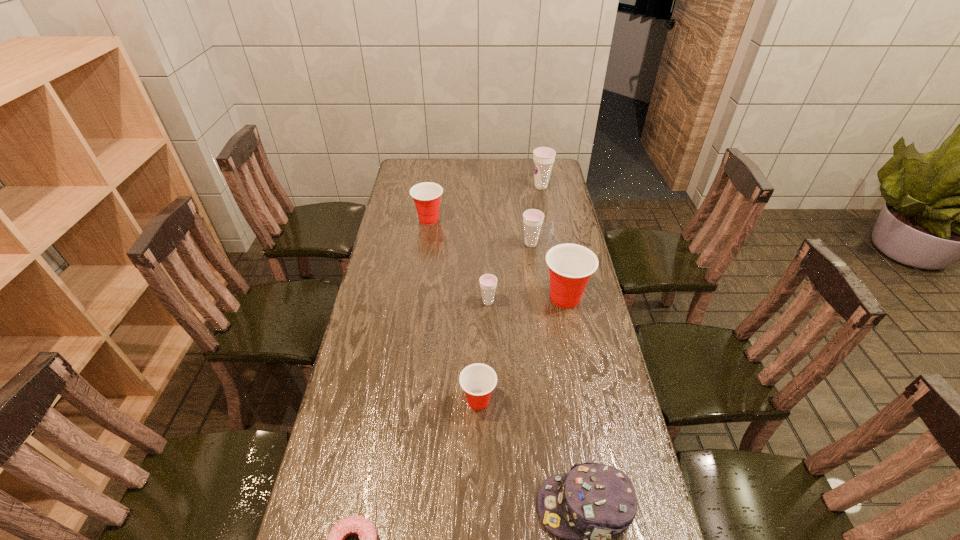
At what (x,y) coordinates should I click in order to perform the action: click on the nearest red cup. Please return your answer as a coordinate pair (x, y). Image resolution: width=960 pixels, height=540 pixels. Looking at the image, I should click on (478, 380).

Identify the location of the nearest cup. Image resolution: width=960 pixels, height=540 pixels. (478, 380).

Locate an element on the screen. vacant area located on the front of the biggest purple cup is located at coordinates (543, 199).

The image size is (960, 540). Identify the location of vacant space situated on the left of the biggest red cup. (482, 298).

The width and height of the screenshot is (960, 540). Find the location of `vacant space situated on the front of the second smallest red cup`. vacant space situated on the front of the second smallest red cup is located at coordinates click(421, 273).

Identify the location of vacant space located on the front of the third farthest object. (535, 272).

The width and height of the screenshot is (960, 540). In order to click on free space located on the left of the leftmost purple cup in this screenshot , I will do `click(420, 302)`.

Where is `free spot located 0.100m on the left of the nearest cup`? The height and width of the screenshot is (540, 960). free spot located 0.100m on the left of the nearest cup is located at coordinates (425, 401).

Find the location of `object at the far edge`. object at the far edge is located at coordinates (543, 157).

Find the location of `object at the left edge`. object at the left edge is located at coordinates (426, 195).